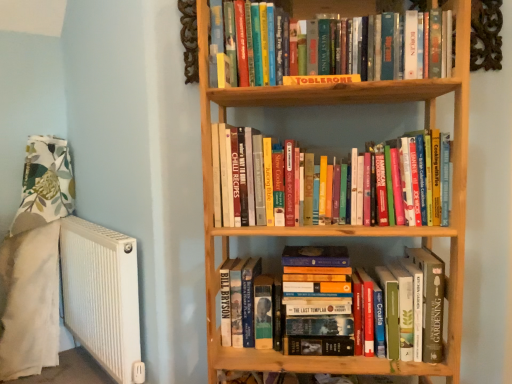
Question: Which is correct: white ribbed radiator at left is inside wooden bookcase at center, or outside of it?

Choices:
 (A) inside
 (B) outside

Answer: (B)

Question: From the image's perspective, is white ribbed radiator at left positioned above or below wooden bookcase at center?

Choices:
 (A) above
 (B) below

Answer: (B)

Question: Which object is the closest to the wooden bookcase at center?

Choices:
 (A) hardcover books at lower center, which is the third book from top to bottom
 (B) white ribbed radiator at left
 (C) hardcover books at center, which appears as the 2th book when viewed from the top
 (D) yellow cardboard toblerone at upper center, which is the 3th book from bottom to top

Answer: (C)

Question: Estimate the real-world distances between objects in this image. Which object is farther from the hardcover books at lower center, which is the first book in bottom-to-top order?

Choices:
 (A) yellow cardboard toblerone at upper center, which is the 3th book from bottom to top
 (B) wooden bookcase at center
 (C) hardcover books at center, arranged as the 2th book when ordered from the bottom
 (D) white ribbed radiator at left

Answer: (D)